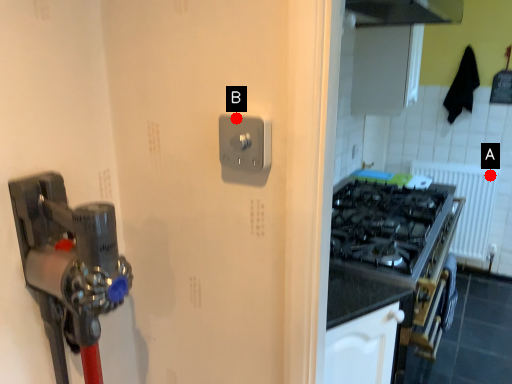
Question: Two points are circled on the image, labeled by A and B beside each circle. Which point is closer to the camera?

Choices:
 (A) A is closer
 (B) B is closer

Answer: (B)